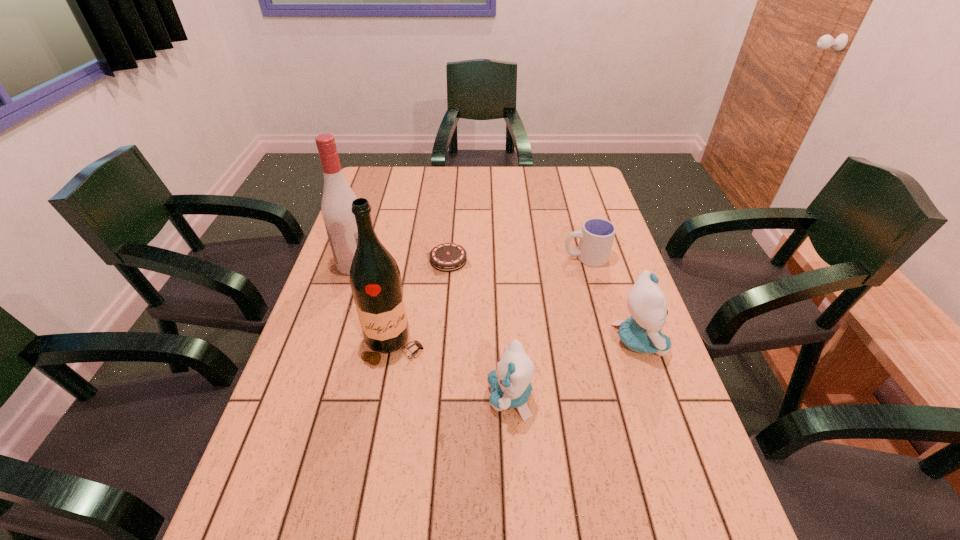
What are the coordinates of `free space between the chocolate cake and the alcohol` in the screenshot? It's located at (401, 262).

Where is `free space between the leftmost object and the third tallest object`? Image resolution: width=960 pixels, height=540 pixels. free space between the leftmost object and the third tallest object is located at coordinates (496, 302).

I want to click on unoccupied area between the left kitten and the leftmost object, so click(432, 331).

You are a GUI agent. You are given a task and a screenshot of the screen. Output one action in this format:
    pyautogui.click(x=<x>, y=<y>)
    Task: Click on the free space between the right kitten and the second shortest object
    
    Given the screenshot: What is the action you would take?
    pyautogui.click(x=612, y=299)

Locate an element on the screen. The height and width of the screenshot is (540, 960). free spot between the third tallest object and the leftmost object is located at coordinates (496, 302).

Identify which object is located as the third nearest to the wine bottle. Please provide its 2D coordinates. Your answer should be formatted as a tuple, i.e. [(x, y)], where the tuple contains the x and y coordinates of a point satisfying the conditions above.

[(336, 207)]

What are the coordinates of `object that is the closest one to the chocolate cake` in the screenshot? It's located at (336, 207).

Identify the location of vacant area in the image that satisfies the following two spatial constraints: 1. on the label of the leftmost object; 2. on the back side of the wine bottle. (328, 345).

Locate an element on the screen. This screenshot has width=960, height=540. free spot that satisfies the following two spatial constraints: 1. on the label of the wine bottle; 2. on the left side of the alcohol is located at coordinates (328, 345).